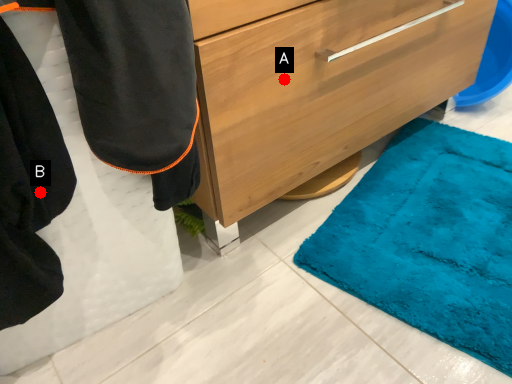
Question: Two points are circled on the image, labeled by A and B beside each circle. Which point is further to the camera?

Choices:
 (A) A is further
 (B) B is further

Answer: (A)